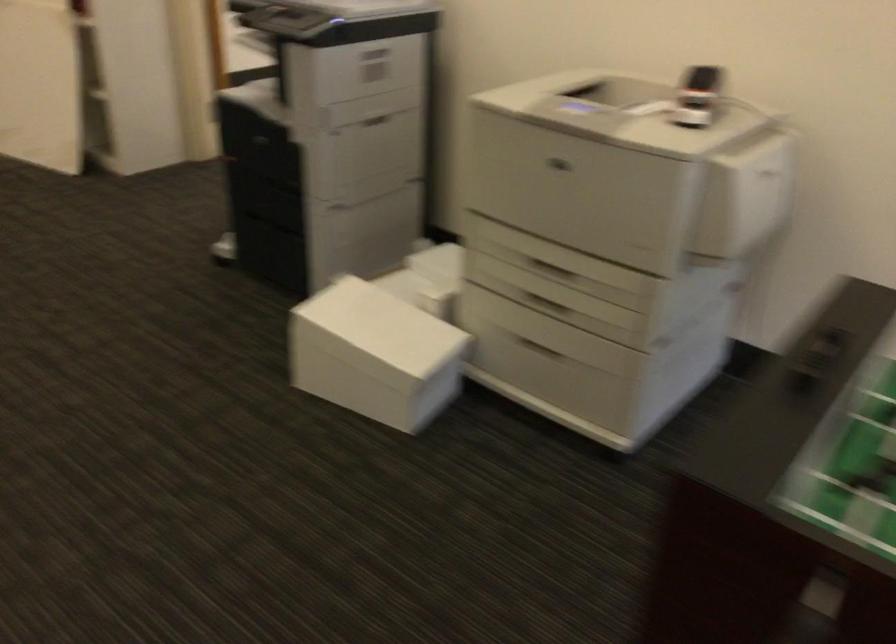
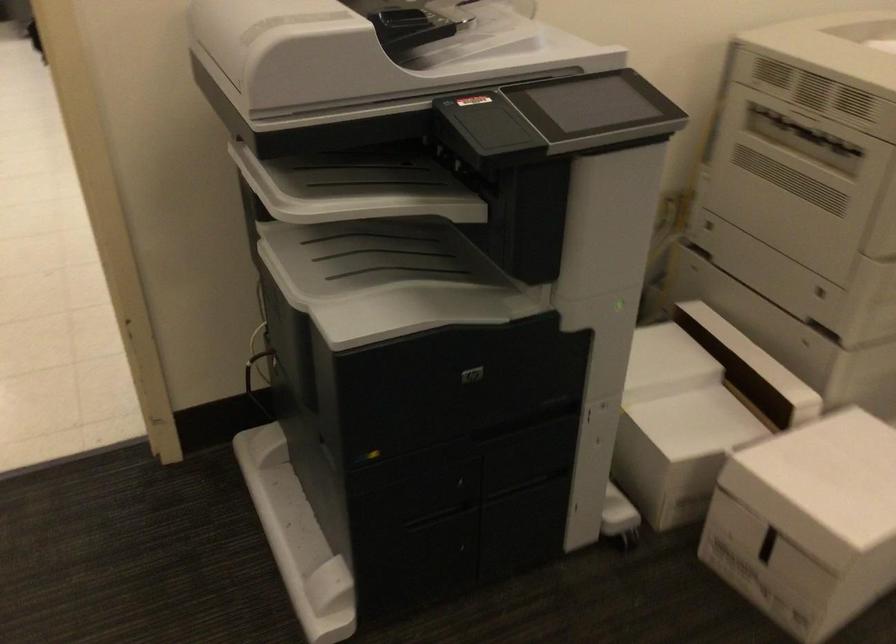
In the second image, find the point that corresponds to pixel 314 307 in the first image.

(807, 522)